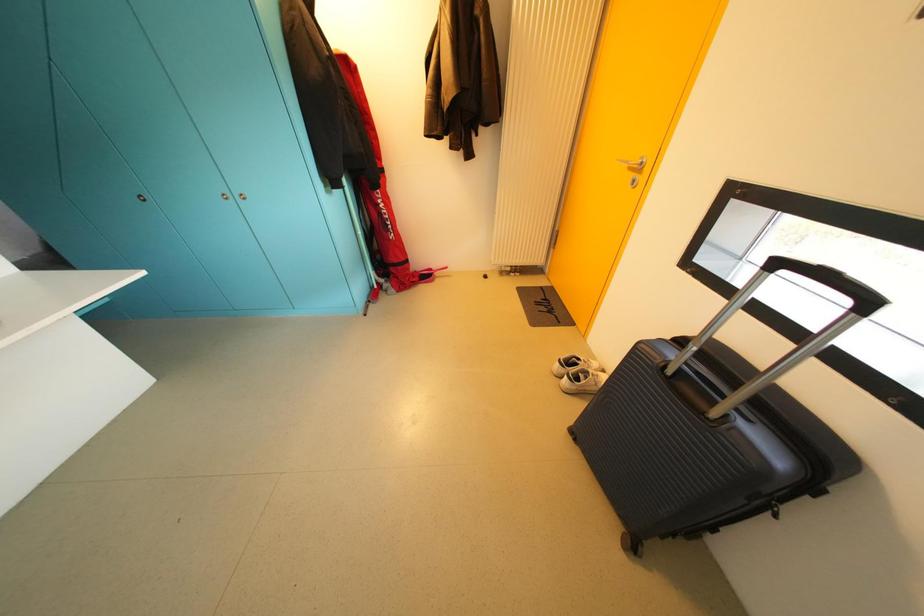
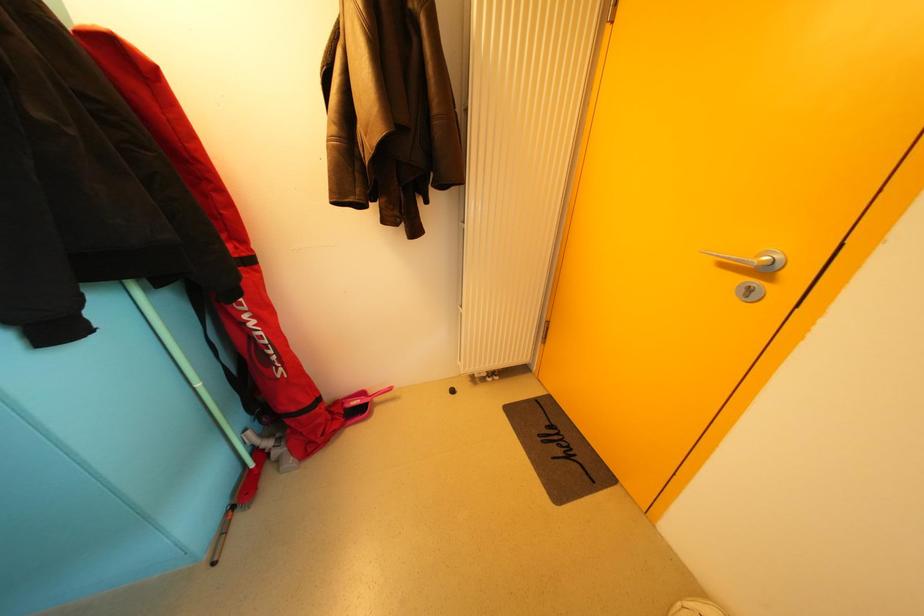
Question: The first image is from the beginning of the video and the second image is from the end. How did the camera likely rotate when shooting the video?

Choices:
 (A) Left
 (B) Right
 (C) Up
 (D) Down

Answer: (B)